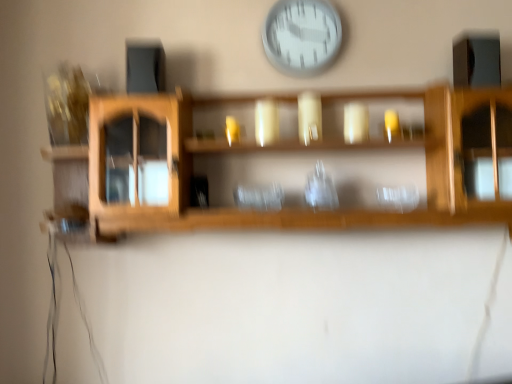
Question: Does transparent glass vase at center have a greater width compared to white plastic wall clock at upper center?

Choices:
 (A) no
 (B) yes

Answer: (B)

Question: Can you confirm if transparent glass vase at center is positioned to the right of white plastic wall clock at upper center?

Choices:
 (A) yes
 (B) no

Answer: (A)

Question: From the image's perspective, is transparent glass vase at center on top of white plastic wall clock at upper center?

Choices:
 (A) no
 (B) yes

Answer: (A)

Question: Is white plastic wall clock at upper center at the back of transparent glass vase at center?

Choices:
 (A) yes
 (B) no

Answer: (B)

Question: Are transparent glass vase at center and white plastic wall clock at upper center far apart?

Choices:
 (A) yes
 (B) no

Answer: (B)

Question: Is point [89, 208] positioned closer to the camera than point [290, 21]?

Choices:
 (A) closer
 (B) farther

Answer: (A)

Question: Considering the positions of wooden shelf at center and white plastic wall clock at upper center in the image, is wooden shelf at center taller or shorter than white plastic wall clock at upper center?

Choices:
 (A) tall
 (B) short

Answer: (A)

Question: Relative to white plastic wall clock at upper center, is wooden shelf at center in front or behind?

Choices:
 (A) behind
 (B) front

Answer: (B)

Question: From the image's perspective, relative to white plastic wall clock at upper center, is wooden shelf at center above or below?

Choices:
 (A) below
 (B) above

Answer: (A)

Question: In terms of width, does white plastic wall clock at upper center look wider or thinner when compared to transparent glass vase at center?

Choices:
 (A) thin
 (B) wide

Answer: (A)

Question: Is white plastic wall clock at upper center bigger or smaller than transparent glass vase at center?

Choices:
 (A) big
 (B) small

Answer: (A)

Question: From the image's perspective, is white plastic wall clock at upper center positioned above or below transparent glass vase at center?

Choices:
 (A) below
 (B) above

Answer: (B)

Question: In the image, is white plastic wall clock at upper center on the left side or the right side of transparent glass vase at center?

Choices:
 (A) left
 (B) right

Answer: (A)

Question: Considering the positions of point (313, 175) and point (101, 134), is point (313, 175) closer or farther from the camera than point (101, 134)?

Choices:
 (A) closer
 (B) farther

Answer: (B)

Question: From the image's perspective, is transparent glass vase at center located above or below wooden shelf at center?

Choices:
 (A) above
 (B) below

Answer: (B)